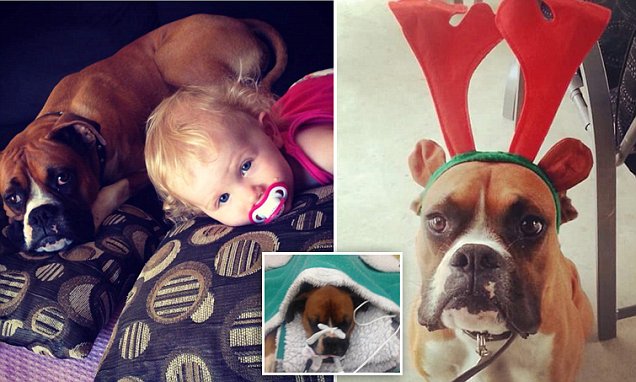
This screenshot has width=636, height=382. What are the coordinates of `blanket` in the screenshot? It's located at (352, 272).